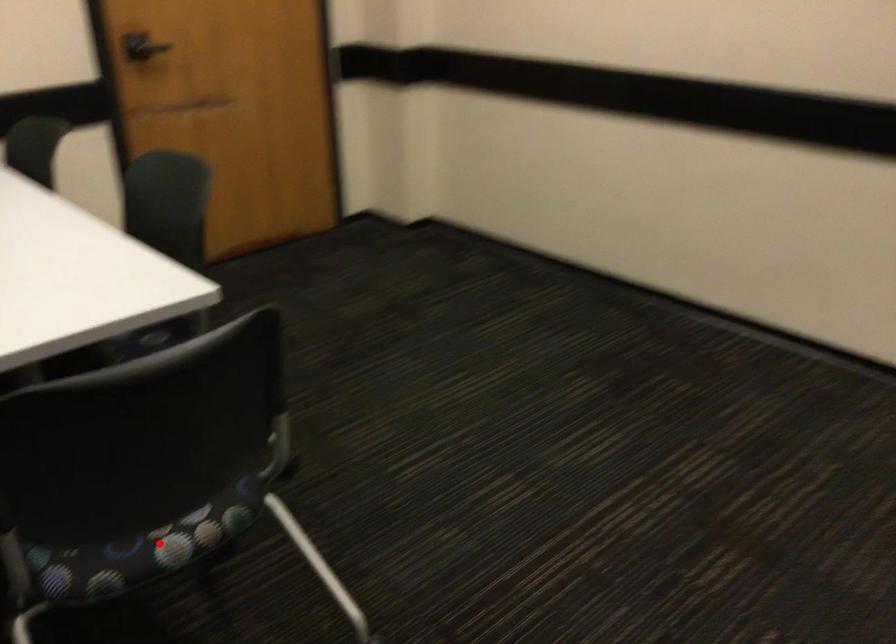
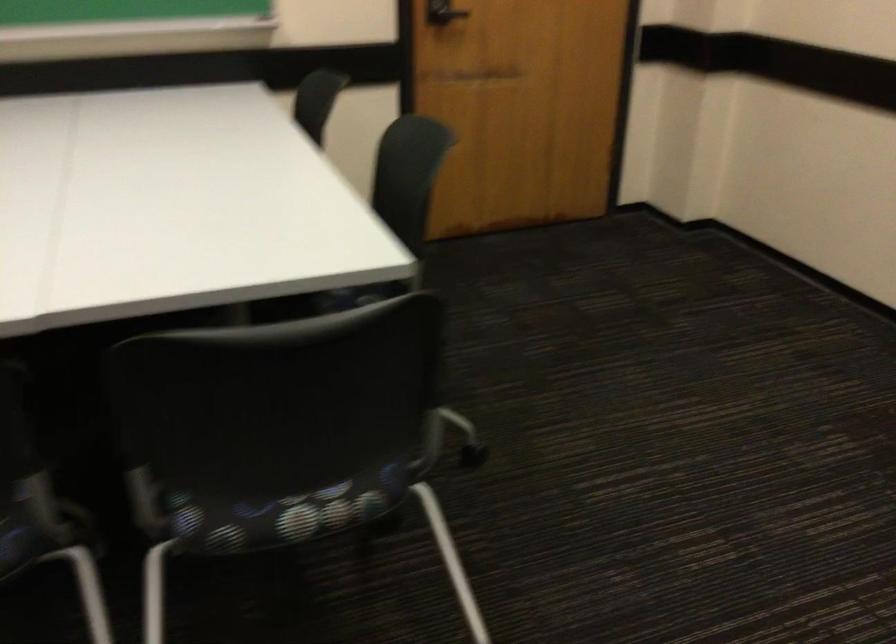
Find the pixel in the second image that matches the highlighted location in the first image.

(286, 514)